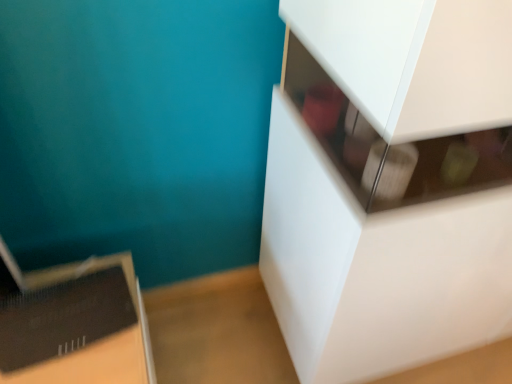
Question: From a real-world perspective, relative to black cardboard box at lower left, is white glossy cabinet at upper right vertically above or below?

Choices:
 (A) below
 (B) above

Answer: (B)

Question: Considering the positions of white glossy cabinet at upper right and black cardboard box at lower left in the image, is white glossy cabinet at upper right taller or shorter than black cardboard box at lower left?

Choices:
 (A) short
 (B) tall

Answer: (B)

Question: Is white glossy cabinet at upper right inside or outside of black cardboard box at lower left?

Choices:
 (A) outside
 (B) inside

Answer: (A)

Question: Considering the positions of black cardboard box at lower left and white glossy cabinet at upper right in the image, is black cardboard box at lower left bigger or smaller than white glossy cabinet at upper right?

Choices:
 (A) big
 (B) small

Answer: (B)

Question: In terms of height, does black cardboard box at lower left look taller or shorter compared to white glossy cabinet at upper right?

Choices:
 (A) short
 (B) tall

Answer: (A)

Question: Looking at their shapes, would you say black cardboard box at lower left is wider or thinner than white glossy cabinet at upper right?

Choices:
 (A) wide
 (B) thin

Answer: (B)

Question: Is point (138, 329) closer or farther from the camera than point (336, 119)?

Choices:
 (A) farther
 (B) closer

Answer: (A)